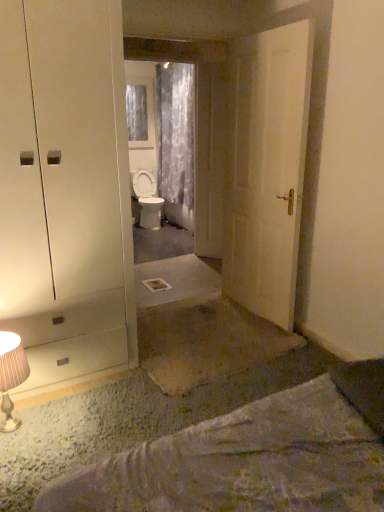
Describe the element at coordinates (11, 375) in the screenshot. The image size is (384, 512). I see `metallic beige table lamp at lower left` at that location.

The height and width of the screenshot is (512, 384). What do you see at coordinates (209, 157) in the screenshot?
I see `wooden door at center, the 2th door positioned from the front` at bounding box center [209, 157].

Describe the element at coordinates (266, 168) in the screenshot. I see `white matte door at center, the first door positioned from the front` at that location.

This screenshot has width=384, height=512. Describe the element at coordinates (140, 113) in the screenshot. I see `transparent plastic window at upper center` at that location.

This screenshot has width=384, height=512. What are the coordinates of `transparent plastic window at upper center` in the screenshot? It's located at (140, 113).

What are the coordinates of `metallic beige table lamp at lower left` in the screenshot? It's located at (x=11, y=375).

Where is `curtain that is behind the transparent glass mirror at center`? curtain that is behind the transparent glass mirror at center is located at coordinates (176, 132).

Could you tell me if translucent floral fabric curtain at center is turned towards transparent glass mirror at center?

No.

Considering the relative sizes of translucent floral fabric curtain at center and transparent glass mirror at center in the image provided, is translucent floral fabric curtain at center shorter than transparent glass mirror at center?

Yes, translucent floral fabric curtain at center is shorter than transparent glass mirror at center.

From a real-world perspective, is translucent floral fabric curtain at center above or below transparent glass mirror at center?

Clearly, from a real-world perspective, translucent floral fabric curtain at center is above transparent glass mirror at center.

Does transparent glass mirror at center appear on the left side of transparent plastic window at upper center?

No.

In terms of size, does transparent glass mirror at center appear bigger or smaller than transparent plastic window at upper center?

Considering their sizes, transparent glass mirror at center takes up more space than transparent plastic window at upper center.

Is point (188, 217) farther from viewer compared to point (137, 106)?

No, it is not.

Which is in front, transparent glass mirror at center or transparent plastic window at upper center?

transparent glass mirror at center is closer to the camera.

Locate an element on the screen. Image resolution: width=384 pixels, height=512 pixels. toilet that appears on the left of transparent glass mirror at center is located at coordinates (147, 200).

From the image's perspective, which one is positioned higher, transparent glass mirror at center or white glossy toilet at center?

transparent glass mirror at center appears higher in the image.

Does transparent glass mirror at center come in front of white glossy toilet at center?

Yes, it is in front of white glossy toilet at center.

Looking at the image, does transparent glass mirror at center seem bigger or smaller compared to white glossy toilet at center?

transparent glass mirror at center is smaller than white glossy toilet at center.

Is wooden door at center, marked as the 1th door in a back-to-front arrangement, inside or outside of transparent plastic window at upper center?

wooden door at center, marked as the 1th door in a back-to-front arrangement, exists outside the volume of transparent plastic window at upper center.

Is point (210, 139) less distant than point (126, 101)?

Yes, point (210, 139) is closer to viewer.

Between wooden door at center, the 2th door positioned from the front, and transparent plastic window at upper center, which one is positioned in front?

Positioned in front is wooden door at center, the 2th door positioned from the front.

In terms of height, does translucent floral fabric curtain at center look taller or shorter compared to white glossy toilet at center?

translucent floral fabric curtain at center is taller than white glossy toilet at center.

Considering the relative positions of translucent floral fabric curtain at center and white glossy toilet at center in the image provided, is translucent floral fabric curtain at center in front of white glossy toilet at center?

Yes, the depth of translucent floral fabric curtain at center is less than that of white glossy toilet at center.

From the image's perspective, does translucent floral fabric curtain at center appear higher than white glossy toilet at center?

Correct, translucent floral fabric curtain at center appears higher than white glossy toilet at center in the image.

From a real-world perspective, is translucent floral fabric curtain at center above or below white glossy toilet at center?

translucent floral fabric curtain at center is above white glossy toilet at center.

Consider the image. From the image's perspective, is transparent plastic window at upper center on translucent floral fabric curtain at center?

Correct, transparent plastic window at upper center appears higher than translucent floral fabric curtain at center in the image.

Is transparent plastic window at upper center smaller than translucent floral fabric curtain at center?

Yes.

What's the angular difference between transparent plastic window at upper center and translucent floral fabric curtain at center's facing directions?

The angular difference between transparent plastic window at upper center and translucent floral fabric curtain at center is 85.9 degrees.

Between transparent plastic window at upper center and translucent floral fabric curtain at center, which one has smaller width?

transparent plastic window at upper center.

Between wooden door at center, the 2th door positioned from the front, and translucent floral fabric curtain at center, which one appears on the right side from the viewer's perspective?

From the viewer's perspective, wooden door at center, the 2th door positioned from the front, appears more on the right side.

Considering the points (219, 206) and (191, 80), which point is behind, point (219, 206) or point (191, 80)?

The point (191, 80) is farther from the camera.

Does wooden door at center, the 2th door positioned from the front, have a smaller size compared to translucent floral fabric curtain at center?

Yes, wooden door at center, the 2th door positioned from the front, is smaller than translucent floral fabric curtain at center.

Are wooden door at center, the 2th door positioned from the front, and translucent floral fabric curtain at center far apart?

wooden door at center, the 2th door positioned from the front, is positioned a significant distance from translucent floral fabric curtain at center.

Locate an element on the screen. mirror in front of the translucent floral fabric curtain at center is located at coordinates (163, 154).

In order to click on mirror that is on the right side of transparent plastic window at upper center in this screenshot , I will do `click(163, 154)`.

When comparing their distances from white glossy toilet at center, does transparent plastic window at upper center or transparent glass mirror at center seem closer?

transparent glass mirror at center lies closer to white glossy toilet at center than the other object.

Looking at the image, which one is located closer to white matte door at center, which ranks as the second door in left-to-right order, translucent floral fabric curtain at center or wooden door at center, placed as the second door when sorted from right to left?

Based on the image, wooden door at center, placed as the second door when sorted from right to left, appears to be nearer to white matte door at center, which ranks as the second door in left-to-right order.

Estimate the real-world distances between objects in this image. Which object is closer to translucent floral fabric curtain at center, white glossy toilet at center or wooden door at center, arranged as the 1th door when viewed from the left?

Based on the image, white glossy toilet at center appears to be nearer to translucent floral fabric curtain at center.

Looking at this image, considering their positions, is translucent floral fabric curtain at center positioned closer to transparent plastic window at upper center than metallic beige table lamp at lower left?

Based on the image, translucent floral fabric curtain at center appears to be nearer to transparent plastic window at upper center.

Looking at the image, which one is located closer to white matte door at center, marked as the first door in a right-to-left arrangement, translucent floral fabric curtain at center or transparent plastic window at upper center?

Based on the image, translucent floral fabric curtain at center appears to be nearer to white matte door at center, marked as the first door in a right-to-left arrangement.

When comparing their distances from metallic beige table lamp at lower left, does transparent glass mirror at center or transparent plastic window at upper center seem further?

Based on the image, transparent plastic window at upper center appears to be further to metallic beige table lamp at lower left.

Based on their spatial positions, is transparent glass mirror at center or transparent plastic window at upper center further from wooden door at center, marked as the 1th door in a back-to-front arrangement?

Based on the image, transparent plastic window at upper center appears to be further to wooden door at center, marked as the 1th door in a back-to-front arrangement.

Estimate the real-world distances between objects in this image. Which object is further from wooden door at center, placed as the second door when sorted from right to left, metallic beige table lamp at lower left or transparent glass mirror at center?

The object further to wooden door at center, placed as the second door when sorted from right to left, is metallic beige table lamp at lower left.

The image size is (384, 512). I want to click on mirror between metallic beige table lamp at lower left and translucent floral fabric curtain at center from front to back, so click(x=163, y=154).

Where is `door located between transparent glass mirror at center and white glossy toilet at center in the depth direction`? The width and height of the screenshot is (384, 512). door located between transparent glass mirror at center and white glossy toilet at center in the depth direction is located at coordinates (209, 157).

Image resolution: width=384 pixels, height=512 pixels. I want to click on curtain between metallic beige table lamp at lower left and white glossy toilet at center along the z-axis, so click(176, 132).

At what (x,y) coordinates should I click in order to perform the action: click on toilet positioned between white matte door at center, arranged as the 2th door when viewed from the back, and transparent plastic window at upper center from near to far. Please return your answer as a coordinate pair (x, y). The image size is (384, 512). Looking at the image, I should click on (147, 200).